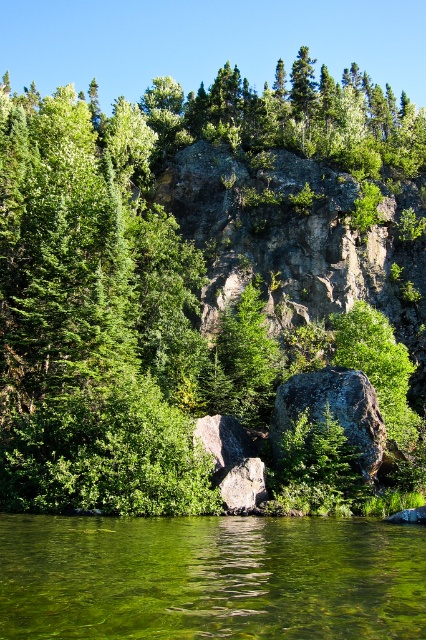
Does point (118, 216) come behind point (253, 593)?

Yes, it is behind point (253, 593).

Can you confirm if green leafy tree at center is smaller than green translucent water at lower center?

Incorrect, green leafy tree at center is not smaller in size than green translucent water at lower center.

This screenshot has width=426, height=640. In order to click on green leafy tree at center in this screenshot , I will do `click(198, 276)`.